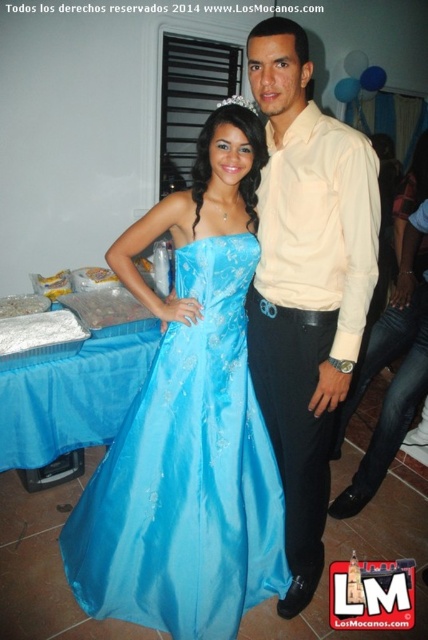
You are a photographer adjusting your camera settings. You notice the shiny blue gown at center and the matte beige shirt at center. Which object should you focus on first to ensure it appears sharp in the photo?

The shiny blue gown at center is further to the viewer than the matte beige shirt at center, so you should focus on the shiny blue gown at center first to ensure it appears sharp.

You are a photographer at a formal event. You need to position a spotlight exactly at the center of the shiny blue gown at center. According to the coordinates provided, where should you aim the spotlight?

The spotlight should be aimed at the coordinates point (187, 474) where the shiny blue gown at center is located.